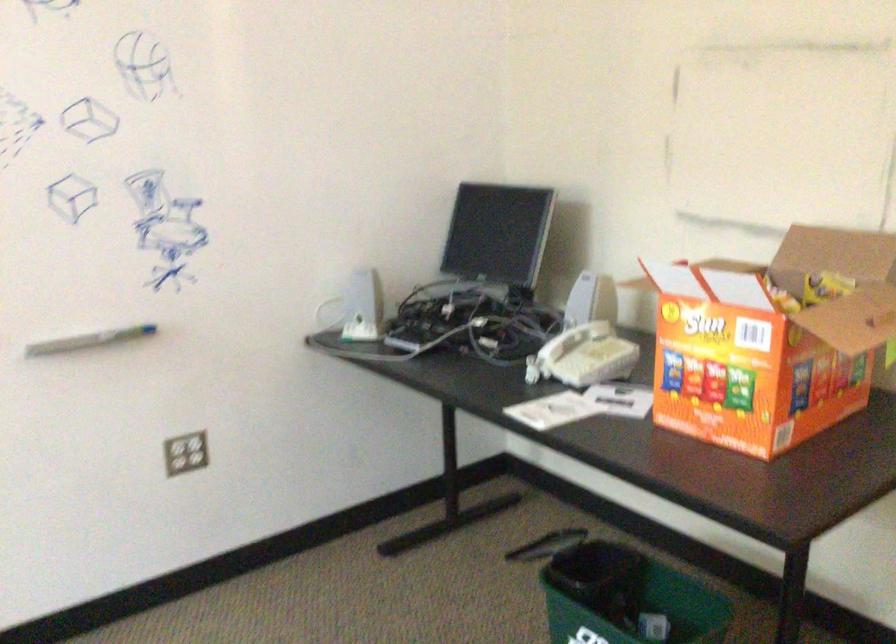
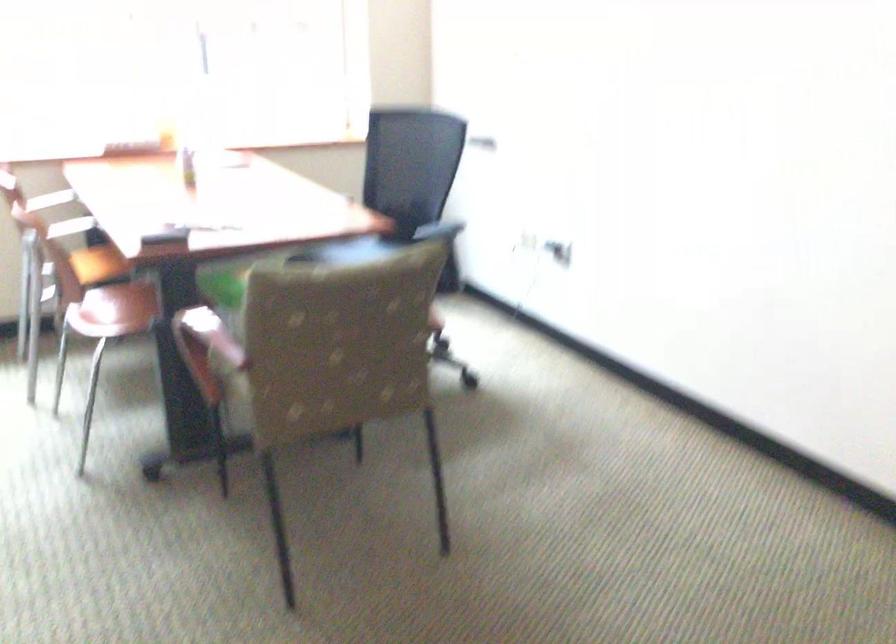
Based on the continuous images, in which direction is the camera rotating?

The camera's rotation is toward left-down.